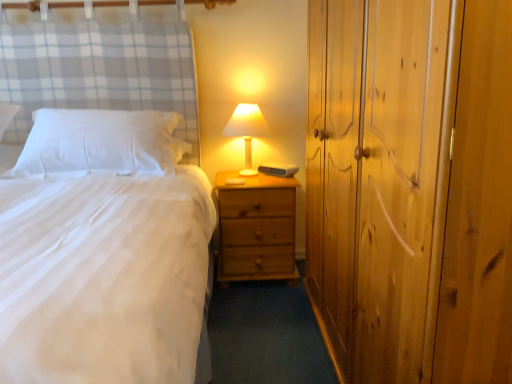
Question: Is white matte bed at center wider or thinner than wooden dresser at right?

Choices:
 (A) wide
 (B) thin

Answer: (A)

Question: Is white matte bed at center inside the boundaries of wooden dresser at right, or outside?

Choices:
 (A) outside
 (B) inside

Answer: (A)

Question: Estimate the real-world distances between objects in this image. Which object is closer to the white soft pillow at left?

Choices:
 (A) matte white lampshade at center
 (B) wooden dresser at right
 (C) natural wood nightstand at center
 (D) white matte bed at center

Answer: (D)

Question: Estimate the real-world distances between objects in this image. Which object is closer to the white matte bed at center?

Choices:
 (A) matte white lampshade at center
 (B) natural wood nightstand at center
 (C) wooden dresser at right
 (D) white soft pillow at left

Answer: (D)